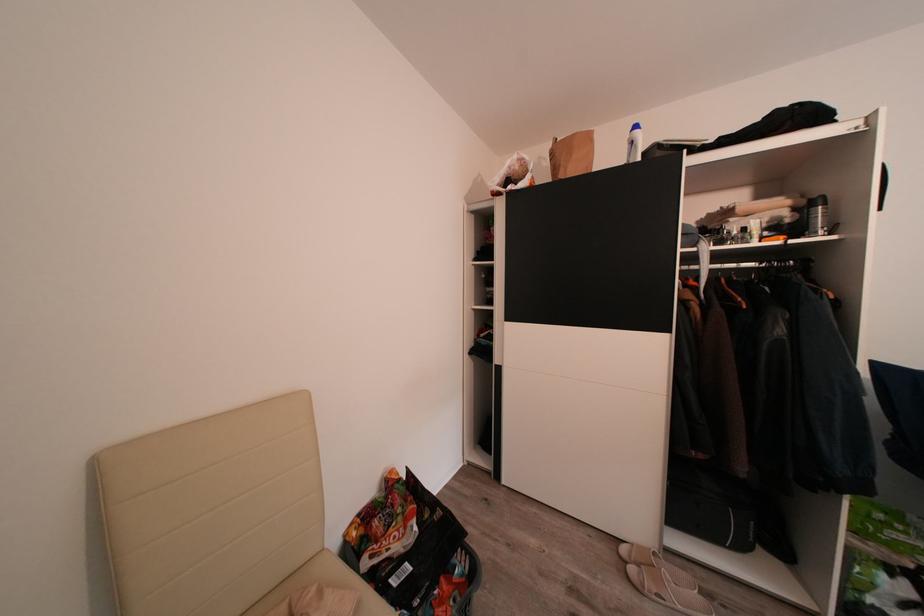
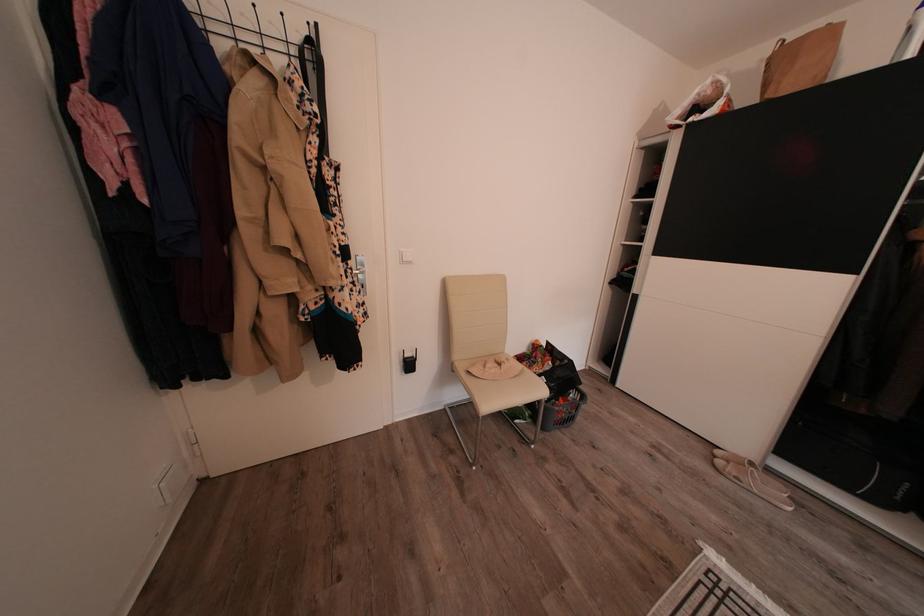
Where in the second image is the point corresponding to (749,553) from the first image?

(888, 507)